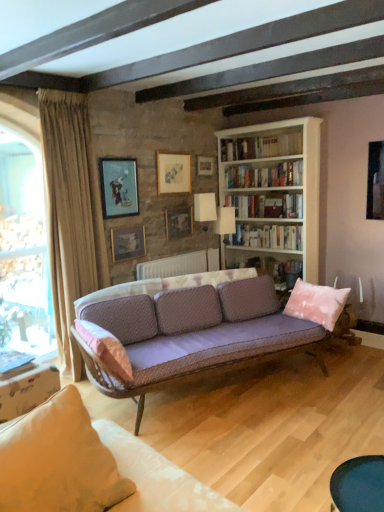
This screenshot has height=512, width=384. I want to click on free space above hardcover books at center, acting as the 2th book starting from the top (from a real-world perspective), so click(x=263, y=164).